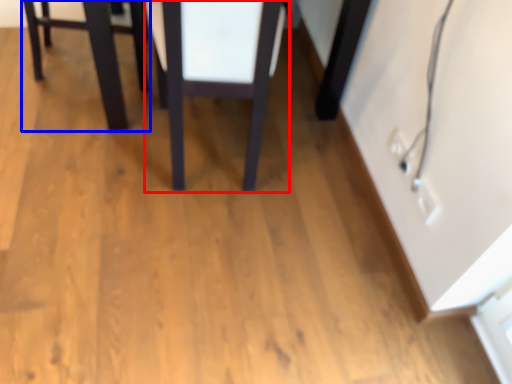
Question: Which point is further to the camera, table (highlighted by a red box) or furniture (highlighted by a blue box)?

Choices:
 (A) table
 (B) furniture

Answer: (B)